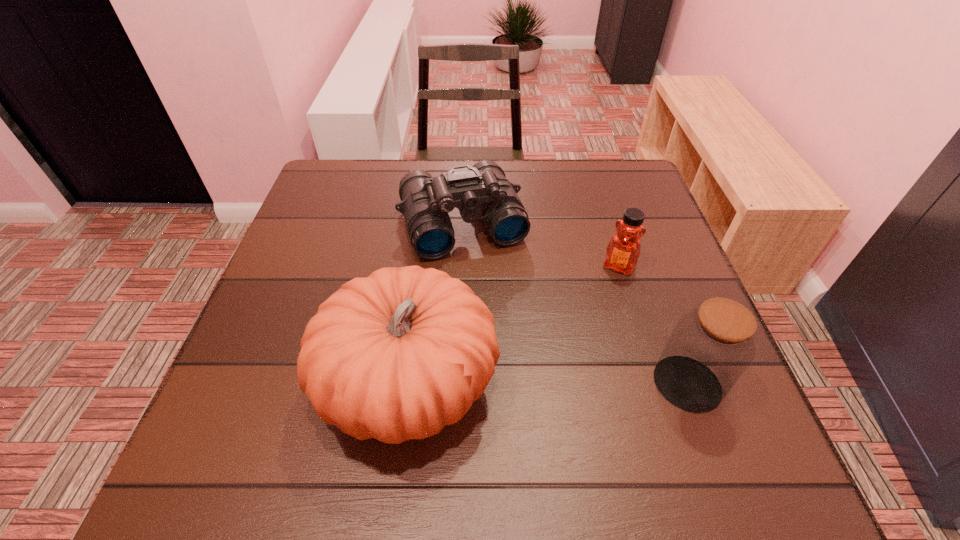
I want to click on vacant area at the right edge of the desktop, so click(609, 222).

Locate an element on the screen. The height and width of the screenshot is (540, 960). blank space at the far left corner is located at coordinates (353, 179).

The image size is (960, 540). In the image, there is a desktop. What are the coordinates of `vacant space at the far right corner` in the screenshot? It's located at (636, 183).

Where is `free space at the near right corner`? free space at the near right corner is located at coordinates (655, 388).

This screenshot has height=540, width=960. Identify the location of vacant space in between the honey and the pumpkin. (515, 326).

What are the coordinates of `free spot between the pumpkin and the honey` in the screenshot? It's located at (515, 326).

At what (x,y) coordinates should I click in order to perform the action: click on free area in between the honey and the binoculars. Please return your answer as a coordinate pair (x, y). The height and width of the screenshot is (540, 960). Looking at the image, I should click on (540, 245).

Image resolution: width=960 pixels, height=540 pixels. What are the coordinates of `free area in between the jar and the binoculars` in the screenshot? It's located at (575, 303).

Locate an element on the screen. free space between the jar and the honey is located at coordinates (653, 325).

At what (x,y) coordinates should I click in order to perform the action: click on vacant area that lies between the pumpkin and the honey. Please return your answer as a coordinate pair (x, y). This screenshot has width=960, height=540. Looking at the image, I should click on (515, 326).